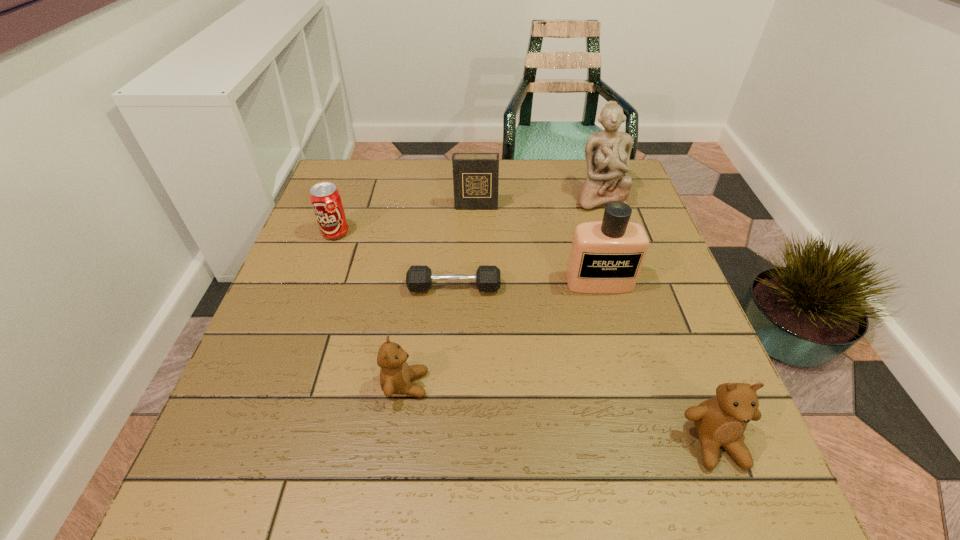
Find the location of a particular element. figurine positioned at the right edge is located at coordinates (607, 153).

Where is `perfume that is at the right edge`? The width and height of the screenshot is (960, 540). perfume that is at the right edge is located at coordinates (606, 257).

Locate an element on the screen. object that is at the far right corner is located at coordinates (607, 153).

You are a GUI agent. You are given a task and a screenshot of the screen. Output one action in this format:
    pyautogui.click(x=<x>, y=<y>)
    Task: Click on the object positioned at the near right corner
    Image resolution: width=960 pixels, height=540 pixels.
    Given the screenshot: What is the action you would take?
    pyautogui.click(x=720, y=421)

In the image, there is a desktop. Identify the location of vacant space at the far edge. (552, 195).

In the image, there is a desktop. Where is `vacant region at the near edge`? vacant region at the near edge is located at coordinates (579, 438).

In the image, there is a desktop. Identify the location of blank space at the left edge. (251, 350).

In the image, there is a desktop. Identify the location of vacant region at the right edge. pos(679,318).

Identify the location of vacant region between the second tallest object and the soda. (468, 258).

The height and width of the screenshot is (540, 960). What are the coordinates of `empty space between the figurine and the soda` in the screenshot? It's located at (468, 215).